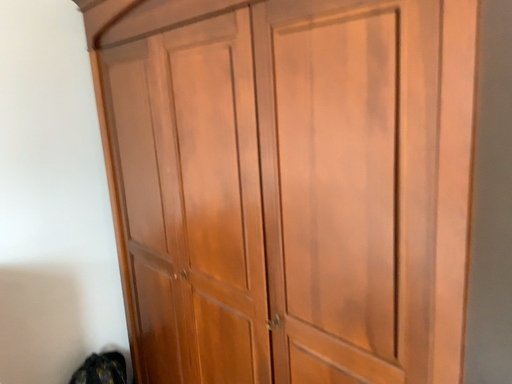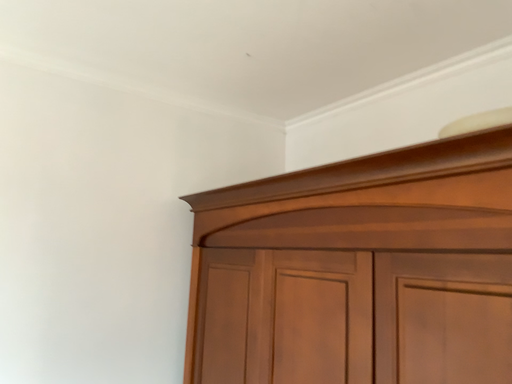
Question: Which way did the camera rotate in the video?

Choices:
 (A) rotated upward
 (B) rotated downward

Answer: (A)